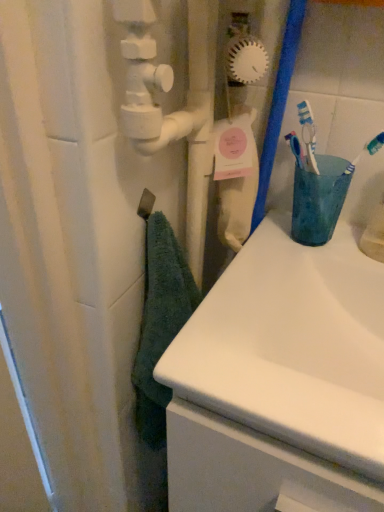
Question: Should I look upward or downward to see teal soft towel at left?

Choices:
 (A) up
 (B) down

Answer: (B)

Question: Is teal soft towel at left behind white glossy sink at center?

Choices:
 (A) yes
 (B) no

Answer: (A)

Question: Considering the relative sizes of teal soft towel at left and white glossy sink at center in the image provided, is teal soft towel at left smaller than white glossy sink at center?

Choices:
 (A) yes
 (B) no

Answer: (A)

Question: From a real-world perspective, does teal soft towel at left stand above white glossy sink at center?

Choices:
 (A) yes
 (B) no

Answer: (A)

Question: Considering the relative sizes of teal soft towel at left and white glossy sink at center in the image provided, is teal soft towel at left shorter than white glossy sink at center?

Choices:
 (A) no
 (B) yes

Answer: (A)

Question: Is teal soft towel at left thinner than white glossy sink at center?

Choices:
 (A) no
 (B) yes

Answer: (B)

Question: Is teal soft towel at left at the right side of white glossy sink at center?

Choices:
 (A) no
 (B) yes

Answer: (A)

Question: Is white glossy sink at center positioned before teal soft towel at left?

Choices:
 (A) no
 (B) yes

Answer: (B)

Question: Is white glossy sink at center positioned behind teal soft towel at left?

Choices:
 (A) no
 (B) yes

Answer: (A)

Question: Could you tell me if white glossy sink at center is turned towards teal soft towel at left?

Choices:
 (A) yes
 (B) no

Answer: (B)

Question: Is white glossy sink at center oriented away from teal soft towel at left?

Choices:
 (A) yes
 (B) no

Answer: (B)

Question: Is white glossy sink at center smaller than teal soft towel at left?

Choices:
 (A) yes
 (B) no

Answer: (B)

Question: Is white glossy sink at center not close to teal soft towel at left?

Choices:
 (A) yes
 (B) no

Answer: (B)

Question: Is matte plastic cup at right at the right side of teal soft towel at left?

Choices:
 (A) yes
 (B) no

Answer: (A)